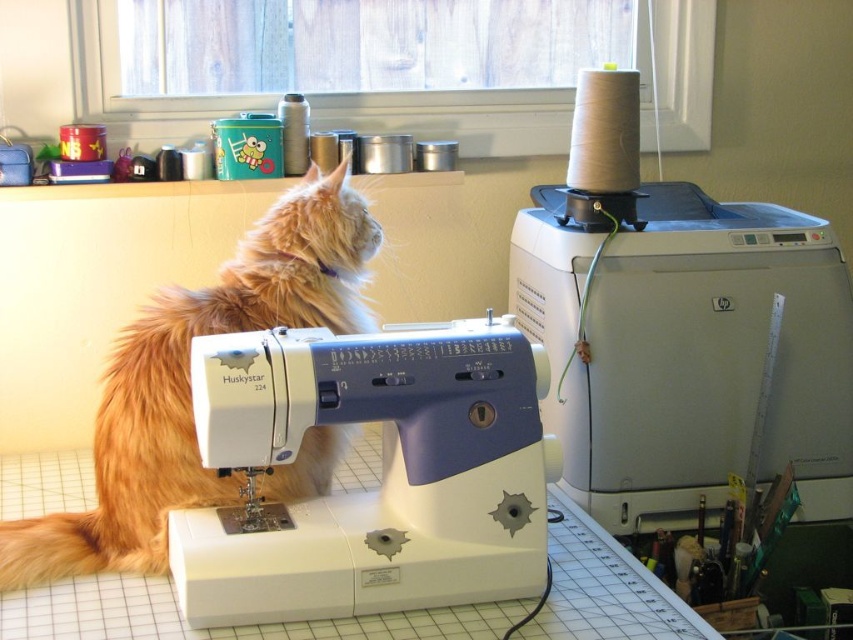
Is white plastic sewing machine at center taller than fuzzy orange cat at left?

No, white plastic sewing machine at center is not taller than fuzzy orange cat at left.

Is white plastic sewing machine at center bigger than fuzzy orange cat at left?

No.

Locate an element on the screen. This screenshot has width=853, height=640. white plastic sewing machine at center is located at coordinates (384, 474).

Where is `white plastic sewing machine at center`? Image resolution: width=853 pixels, height=640 pixels. white plastic sewing machine at center is located at coordinates (384, 474).

Is point (680, 417) farther from camera compared to point (271, 253)?

Yes.

The height and width of the screenshot is (640, 853). I want to click on white plastic sewing machine at upper right, so click(680, 332).

Is white plastic sewing machine at upper right further to camera compared to white plastic sewing machine at center?

Yes, white plastic sewing machine at upper right is further from the viewer.

In the scene shown: Can you confirm if white plastic sewing machine at upper right is positioned above white plastic sewing machine at center?

Correct, white plastic sewing machine at upper right is located above white plastic sewing machine at center.

The width and height of the screenshot is (853, 640). I want to click on white plastic sewing machine at upper right, so click(680, 332).